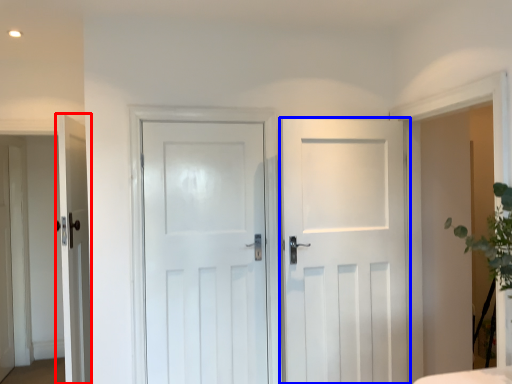
Question: Among these objects, which one is nearest to the camera, door (highlighted by a red box) or door (highlighted by a blue box)?

Choices:
 (A) door
 (B) door

Answer: (B)